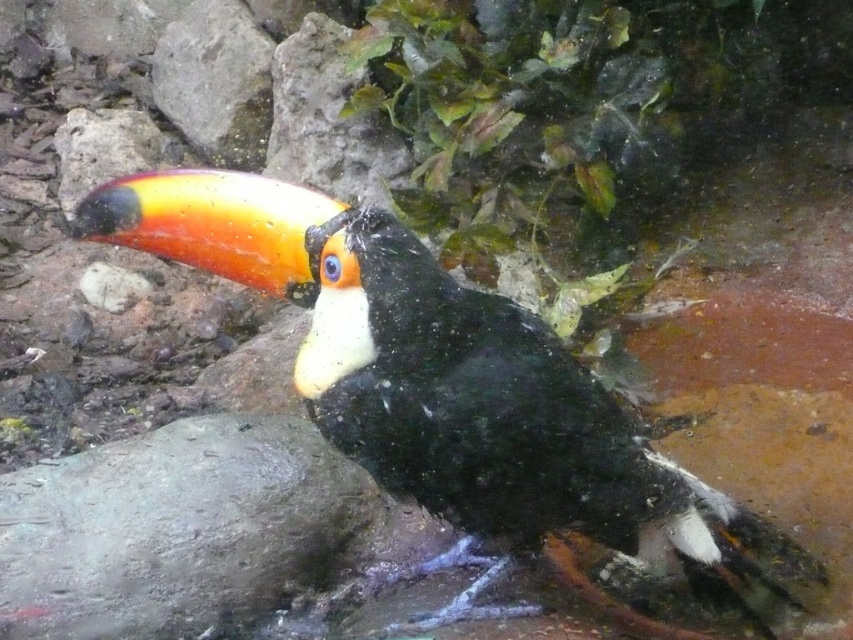
Which is below, shiny black toucan at center or gray rough stone at lower left?

gray rough stone at lower left

Is shiny black toucan at center above gray rough stone at lower left?

Correct, shiny black toucan at center is located above gray rough stone at lower left.

You are a GUI agent. You are given a task and a screenshot of the screen. Output one action in this format:
    pyautogui.click(x=<x>, y=<y>)
    Task: Click on the shiny black toucan at center
    This screenshot has height=640, width=853.
    Given the screenshot: What is the action you would take?
    pyautogui.click(x=454, y=388)